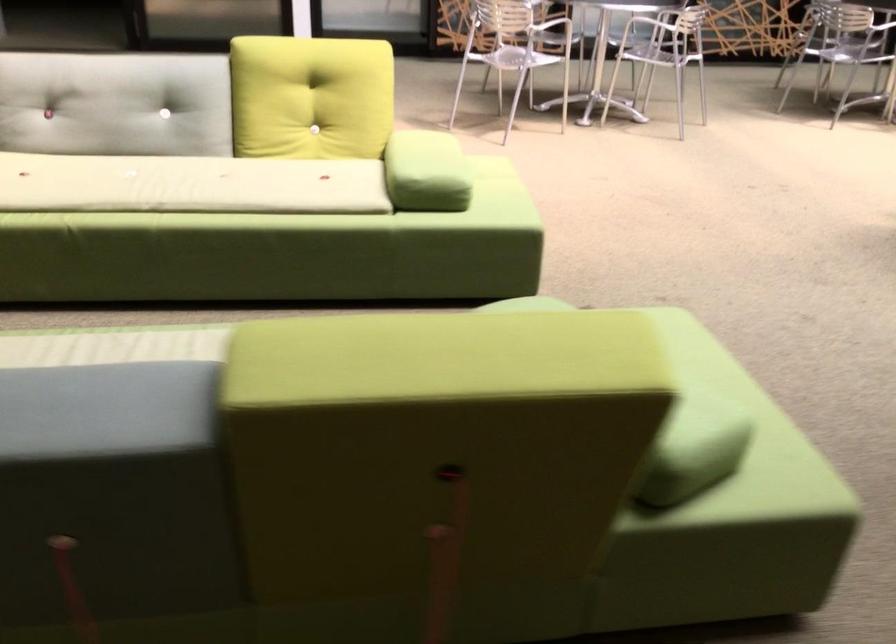
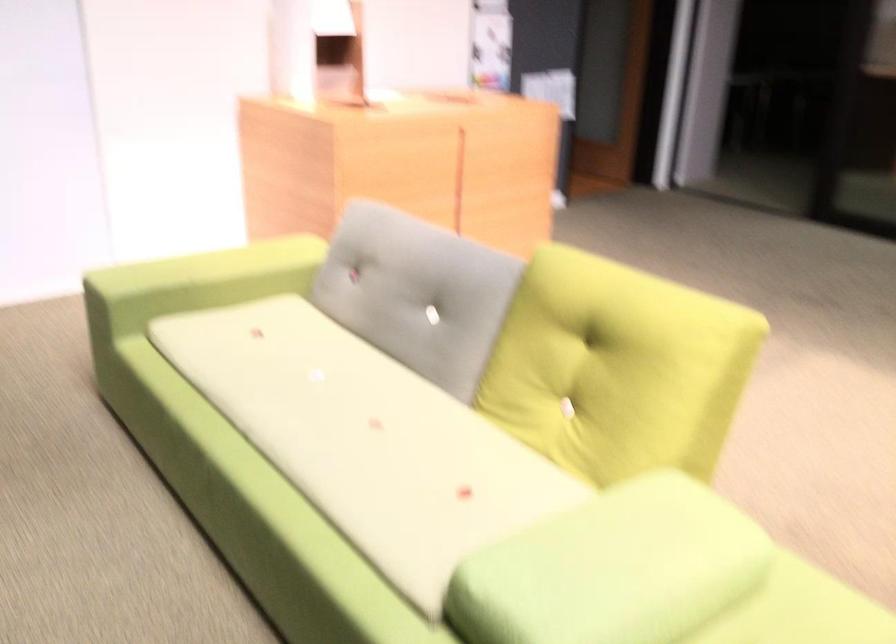
Locate, in the second image, the point that corresponds to pixel 330 84 in the first image.

(616, 368)